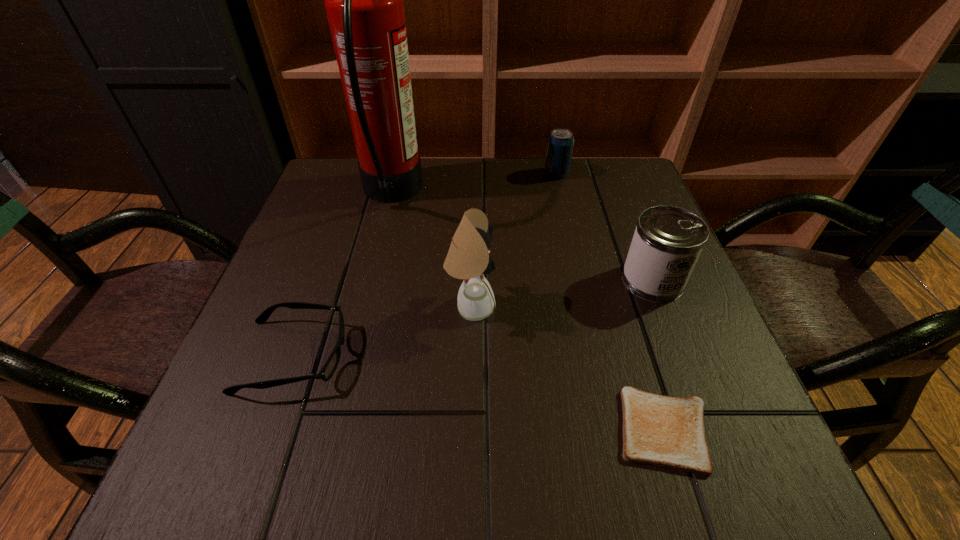
Find the location of `fire extinguisher`. fire extinguisher is located at coordinates (363, 0).

Where is `doll`? The width and height of the screenshot is (960, 540). doll is located at coordinates (468, 258).

At what (x,y) coordinates should I click in order to perform the action: click on the fifth shortest object. Please return your answer as a coordinate pair (x, y). The height and width of the screenshot is (540, 960). Looking at the image, I should click on (468, 258).

This screenshot has width=960, height=540. Find the location of `can`. can is located at coordinates (667, 242).

The image size is (960, 540). Find the location of `pop soda`. pop soda is located at coordinates (560, 143).

Image resolution: width=960 pixels, height=540 pixels. I want to click on spectacles, so click(329, 368).

Locate an element on the screen. The height and width of the screenshot is (540, 960). the shortest object is located at coordinates (662, 431).

What are the coordinates of `vacant space located 0.190m on the front-facing side of the fire extinguisher` in the screenshot? It's located at (499, 193).

Where is `vacant space located 0.270m at the front face of the second tallest object`? vacant space located 0.270m at the front face of the second tallest object is located at coordinates [641, 307].

The image size is (960, 540). Identify the location of vacant position located 0.260m on the back of the fourth shortest object. (617, 189).